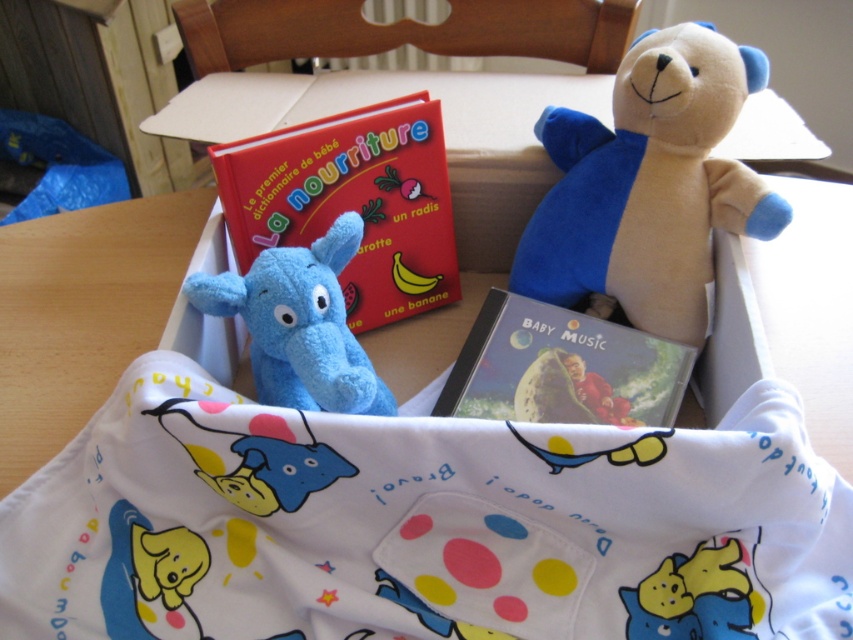
In the scene shown: Who is shorter, matte plastic cd at center or soft blue plush elephant at center?

With less height is matte plastic cd at center.

Can you confirm if matte plastic cd at center is bigger than soft blue plush elephant at center?

Incorrect, matte plastic cd at center is not larger than soft blue plush elephant at center.

Describe the element at coordinates (561, 369) in the screenshot. I see `matte plastic cd at center` at that location.

At what (x,y) coordinates should I click in order to perform the action: click on matte plastic cd at center. Please return your answer as a coordinate pair (x, y). The height and width of the screenshot is (640, 853). Looking at the image, I should click on (561, 369).

Who is more distant from viewer, (282, 216) or (554, 368)?

The point (282, 216) is behind.

Identify the location of red matte book at center. coord(351,202).

Who is lower down, red matte book at center or soft blue plush elephant at center?

soft blue plush elephant at center is lower down.

Can you confirm if red matte book at center is positioned above soft blue plush elephant at center?

Yes.

Is point (271, 172) in front of point (334, 280)?

No, it is behind (334, 280).

In order to click on red matte book at center in this screenshot , I will do `click(351, 202)`.